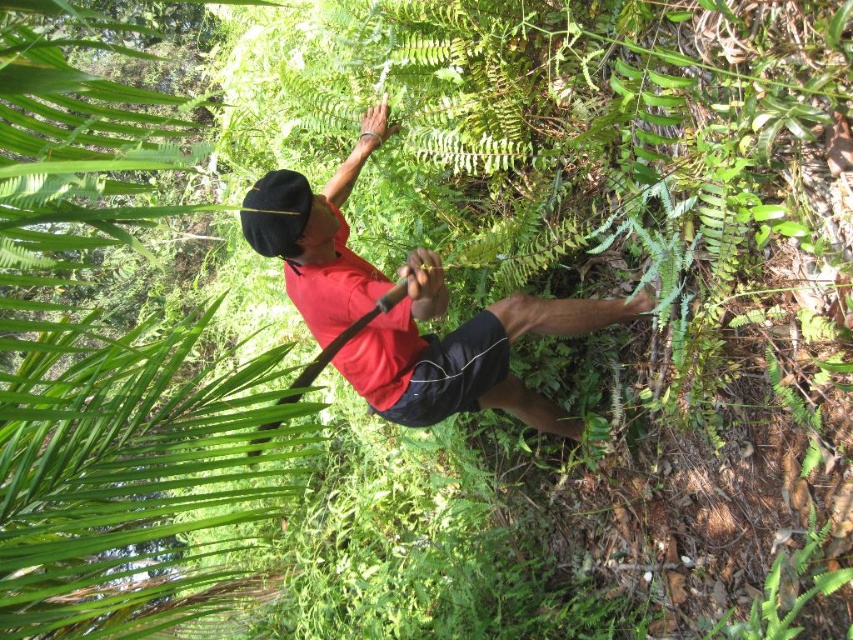
Question: Which of the following is the farthest from the observer?

Choices:
 (A) red matte shirt at center
 (B) green leafy tree at upper left

Answer: (A)

Question: Is green leafy tree at upper left positioned behind red matte shirt at center?

Choices:
 (A) yes
 (B) no

Answer: (B)

Question: Can you confirm if green leafy tree at upper left is positioned to the right of red matte shirt at center?

Choices:
 (A) yes
 (B) no

Answer: (B)

Question: Is green leafy tree at upper left smaller than red matte shirt at center?

Choices:
 (A) no
 (B) yes

Answer: (A)